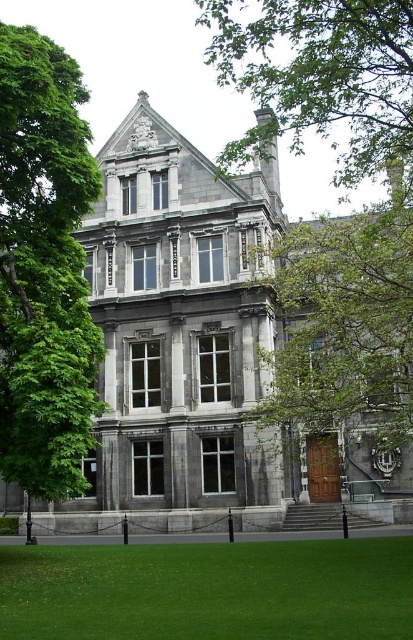
You are standing at the base of the stairs leading to the historic building. You notice a point marked at coordinates [339,182]. What object does this point indicate?

The point marked at coordinates [339,182] indicates the green leafy tree at center.

You are standing in front of the historic building and notice two green leafy trees. One is labeled as the green leafy tree at left and the other as the green leafy tree at upper center. Which tree is positioned more to the left side of the building?

The green leafy tree at left is positioned more to the left side of the building compared to the green leafy tree at upper center.